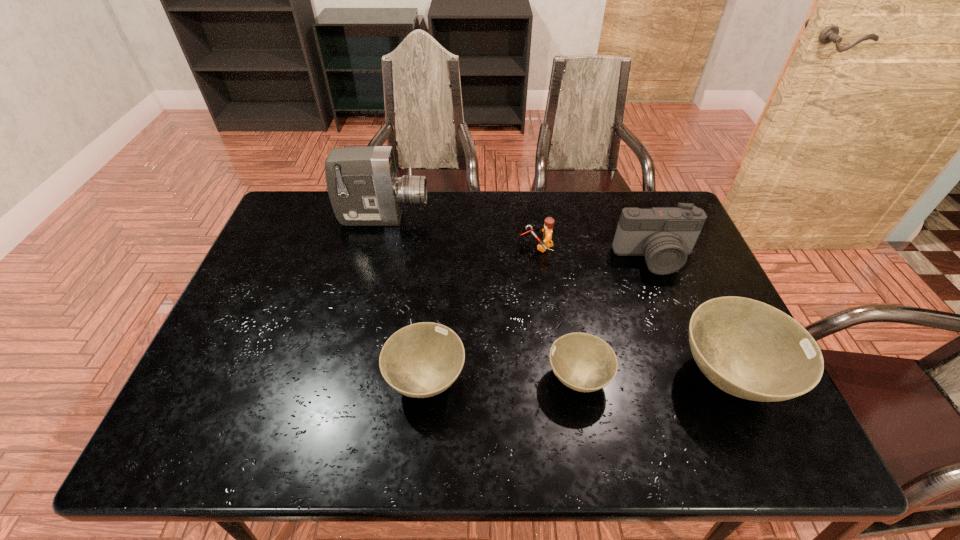
At what (x,y) coordinates should I click in order to perform the action: click on the second shortest bowl. Please return your answer as a coordinate pair (x, y). Looking at the image, I should click on (421, 360).

You are a GUI agent. You are given a task and a screenshot of the screen. Output one action in this format:
    pyautogui.click(x=<x>, y=<y>)
    Task: Click on the leftmost bowl
    This screenshot has width=960, height=540.
    Given the screenshot: What is the action you would take?
    pyautogui.click(x=421, y=360)

Where is `the shortest bowl`? the shortest bowl is located at coordinates (583, 362).

The image size is (960, 540). What are the coordinates of `the second bowl from right to left` in the screenshot? It's located at (583, 362).

This screenshot has height=540, width=960. In order to click on the tallest bowl in this screenshot , I will do `click(749, 349)`.

Find the location of a particular element. The image size is (960, 540). camcorder is located at coordinates (364, 190).

At what (x,y) coordinates should I click in order to perform the action: click on the farthest object. Please return your answer as a coordinate pair (x, y). This screenshot has height=540, width=960. Looking at the image, I should click on (364, 190).

Locate an element on the screen. Image resolution: width=960 pixels, height=540 pixels. camera is located at coordinates (665, 236).

Identify the location of Lego. (547, 242).

Where is `free region located on the back of the second shortest bowl`? This screenshot has height=540, width=960. free region located on the back of the second shortest bowl is located at coordinates (440, 241).